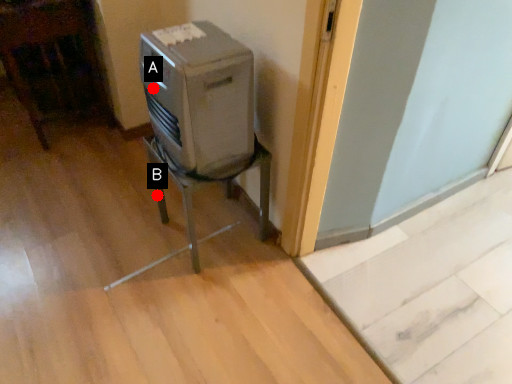
Question: Two points are circled on the image, labeled by A and B beside each circle. Which point is farther to the camera?

Choices:
 (A) A is further
 (B) B is further

Answer: (B)